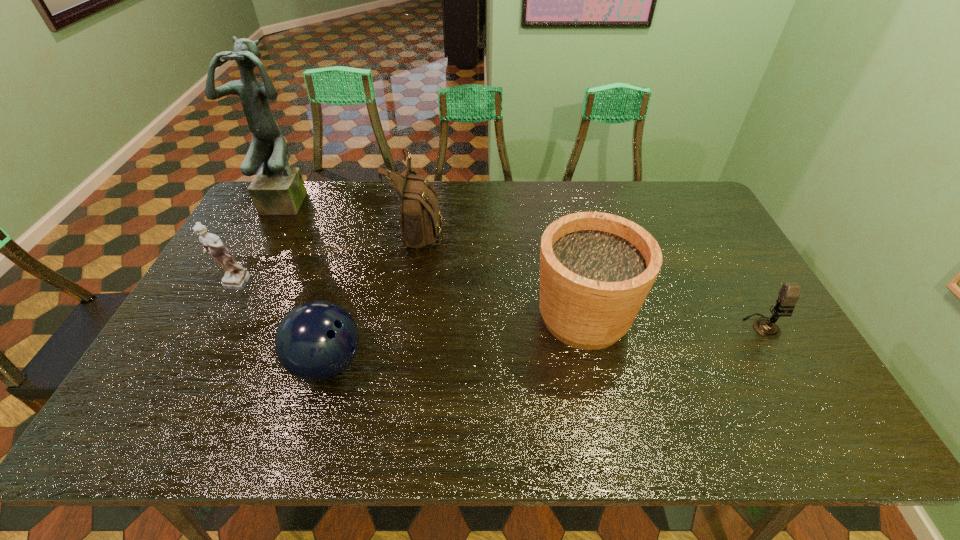
In the image, there is a desktop. In order to click on vacant space at the left edge in this screenshot , I will do `click(200, 313)`.

Find the location of a particular element. free region at the right edge of the desktop is located at coordinates click(x=705, y=268).

Where is `vacant point located between the flowerpot and the third object from left to right`? This screenshot has height=540, width=960. vacant point located between the flowerpot and the third object from left to right is located at coordinates click(x=455, y=340).

Where is `vacant area between the tallest object and the flowerpot`? The width and height of the screenshot is (960, 540). vacant area between the tallest object and the flowerpot is located at coordinates (437, 258).

Locate an element on the screen. empty location between the microphone and the sculpture is located at coordinates (526, 263).

Locate an element on the screen. This screenshot has height=540, width=960. free space between the third object from right to left and the sculpture is located at coordinates (355, 214).

This screenshot has width=960, height=540. I want to click on vacant space in between the figurine and the second object from right to left, so click(408, 301).

The width and height of the screenshot is (960, 540). Identify the location of unoccupied position between the figurine and the fifth object from left to right. (408, 301).

At what (x,y) coordinates should I click in order to perform the action: click on free space between the third object from right to left and the sculpture. Please return your answer as a coordinate pair (x, y). This screenshot has width=960, height=540. Looking at the image, I should click on (355, 214).

Find the location of a particular element. unoccupied area between the flowerpot and the bowling ball is located at coordinates (455, 340).